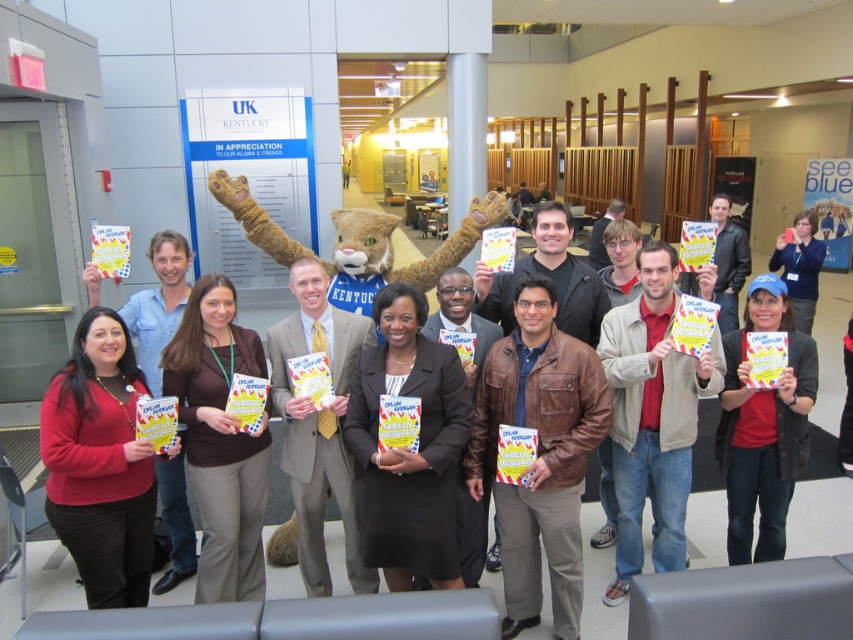
You are organizing a photo shoot and need to position a tripod between the furry plush at center and the matte red sweater at lower left. Based on their positions, which side of the tripod should face the mascot?

The furry plush at center is to the right of the matte red sweater at lower left, so the tripod should be positioned with its right side facing the mascot to maintain alignment between the two objects.

You are standing at the camera position and want to take a photo of the point marked at coordinates point (149, 349). Can you reach it without moving your camera?

The point (149, 349) is 3.59 meters from the camera. Since the camera can focus on objects at that distance, you can take the photo without moving the camera.